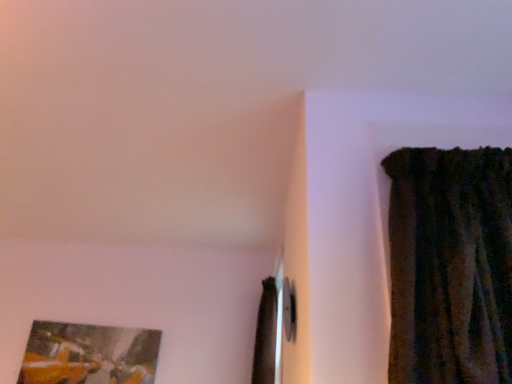
Describe the element at coordinates (266, 334) in the screenshot. Image resolution: width=512 pixels, height=384 pixels. I see `brown velvet curtain at center` at that location.

At what (x,y) coordinates should I click in order to perform the action: click on brown velvet curtain at center. Please return your answer as a coordinate pair (x, y). The width and height of the screenshot is (512, 384). Looking at the image, I should click on click(266, 334).

Measure the distance between brown velvet curtain at center and camera.

2.19 meters.

What do you see at coordinates (89, 354) in the screenshot?
I see `matte wooden picture frame at lower left` at bounding box center [89, 354].

You are a GUI agent. You are given a task and a screenshot of the screen. Output one action in this format:
    pyautogui.click(x=<x>, y=<y>)
    Task: Click on the matte wooden picture frame at lower left
    
    Given the screenshot: What is the action you would take?
    89,354

You are a GUI agent. You are given a task and a screenshot of the screen. Output one action in this format:
    pyautogui.click(x=<x>, y=<y>)
    Task: Click on the brown velvet curtain at center
    The height and width of the screenshot is (384, 512).
    Given the screenshot: What is the action you would take?
    pyautogui.click(x=266, y=334)

Which object is positioned more to the left, matte wooden picture frame at lower left or brown velvet curtain at center?

From the viewer's perspective, matte wooden picture frame at lower left appears more on the left side.

Which object is closer to the camera taking this photo, matte wooden picture frame at lower left or brown velvet curtain at center?

brown velvet curtain at center is in front.

Considering the positions of points (132, 344) and (265, 361), is point (132, 344) farther from camera compared to point (265, 361)?

Yes.

From the image's perspective, is matte wooden picture frame at lower left located above brown velvet curtain at center?

Incorrect, from the image's perspective, matte wooden picture frame at lower left is lower than brown velvet curtain at center.

From a real-world perspective, who is located higher, matte wooden picture frame at lower left or brown velvet curtain at center?

brown velvet curtain at center, from a real-world perspective.

Considering the sizes of objects matte wooden picture frame at lower left and brown velvet curtain at center in the image provided, who is thinner, matte wooden picture frame at lower left or brown velvet curtain at center?

Thinner between the two is matte wooden picture frame at lower left.

Is matte wooden picture frame at lower left taller than brown velvet curtain at center?

No, matte wooden picture frame at lower left is not taller than brown velvet curtain at center.

Between matte wooden picture frame at lower left and brown velvet curtain at center, which one has smaller size?

matte wooden picture frame at lower left is smaller.

Is matte wooden picture frame at lower left situated inside brown velvet curtain at center or outside?

matte wooden picture frame at lower left is located beyond the bounds of brown velvet curtain at center.

Would you consider matte wooden picture frame at lower left to be distant from brown velvet curtain at center?

Yes, matte wooden picture frame at lower left is far from brown velvet curtain at center.

Is matte wooden picture frame at lower left facing towards brown velvet curtain at center?

No, matte wooden picture frame at lower left is not oriented towards brown velvet curtain at center.

Where is `picture frame below the brown velvet curtain at center (from a real-world perspective)`? The height and width of the screenshot is (384, 512). picture frame below the brown velvet curtain at center (from a real-world perspective) is located at coordinates (89, 354).

Based on their positions, is brown velvet curtain at center located to the left or right of matte wooden picture frame at lower left?

brown velvet curtain at center is positioned on matte wooden picture frame at lower left's right side.

Considering the relative positions of brown velvet curtain at center and matte wooden picture frame at lower left in the image provided, is brown velvet curtain at center behind matte wooden picture frame at lower left?

No, it is not.

Does point (269, 332) lie in front of point (111, 343)?

Yes, point (269, 332) is closer to viewer.

From the image's perspective, is brown velvet curtain at center located above or below matte wooden picture frame at lower left?

From the image's perspective, brown velvet curtain at center appears above matte wooden picture frame at lower left.

From a real-world perspective, between brown velvet curtain at center and matte wooden picture frame at lower left, who is vertically higher?

In real-world perspective, brown velvet curtain at center is above.

Does brown velvet curtain at center have a lesser width compared to matte wooden picture frame at lower left?

No, brown velvet curtain at center is not thinner than matte wooden picture frame at lower left.

Considering the relative sizes of brown velvet curtain at center and matte wooden picture frame at lower left in the image provided, is brown velvet curtain at center shorter than matte wooden picture frame at lower left?

No, brown velvet curtain at center is not shorter than matte wooden picture frame at lower left.

Considering the relative sizes of brown velvet curtain at center and matte wooden picture frame at lower left in the image provided, is brown velvet curtain at center bigger than matte wooden picture frame at lower left?

Correct, brown velvet curtain at center is larger in size than matte wooden picture frame at lower left.

Is brown velvet curtain at center situated inside matte wooden picture frame at lower left or outside?

brown velvet curtain at center is not enclosed by matte wooden picture frame at lower left.

Are brown velvet curtain at center and matte wooden picture frame at lower left beside each other?

They are not placed beside each other.

Is brown velvet curtain at center turned away from matte wooden picture frame at lower left?

No, matte wooden picture frame at lower left is not at the back of brown velvet curtain at center.

Locate an element on the screen. The width and height of the screenshot is (512, 384). picture frame on the left of the brown velvet curtain at center is located at coordinates (89, 354).

Locate an element on the screen. This screenshot has width=512, height=384. curtain located above the matte wooden picture frame at lower left (from the image's perspective) is located at coordinates (266, 334).

The image size is (512, 384). In order to click on picture frame on the left of brown velvet curtain at center in this screenshot , I will do `click(89, 354)`.